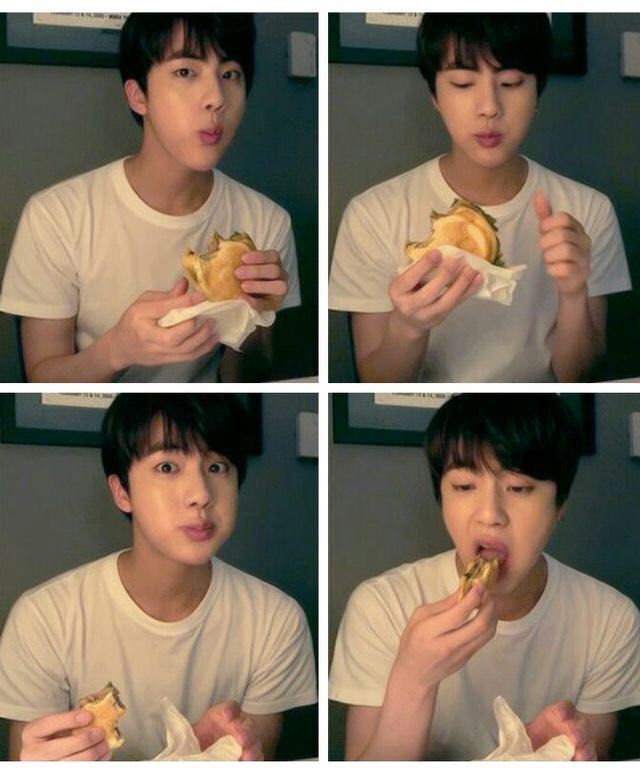
This screenshot has height=770, width=640. I want to click on wall, so click(269, 543).